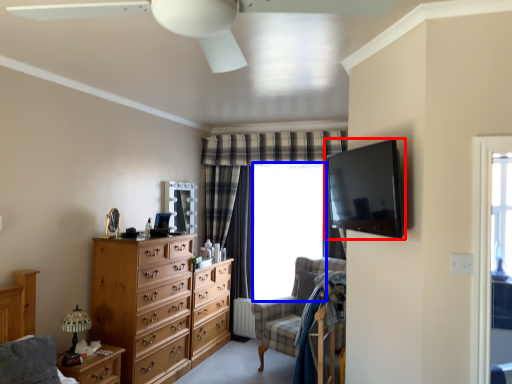
Question: Which object is further to the camera taking this photo, television (highlighted by a red box) or window screen (highlighted by a blue box)?

Choices:
 (A) television
 (B) window screen

Answer: (B)